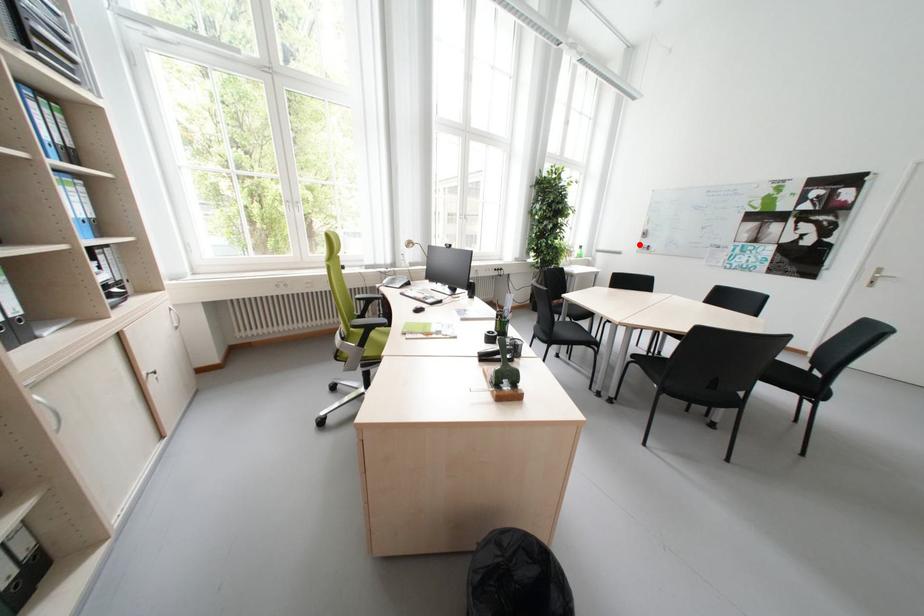
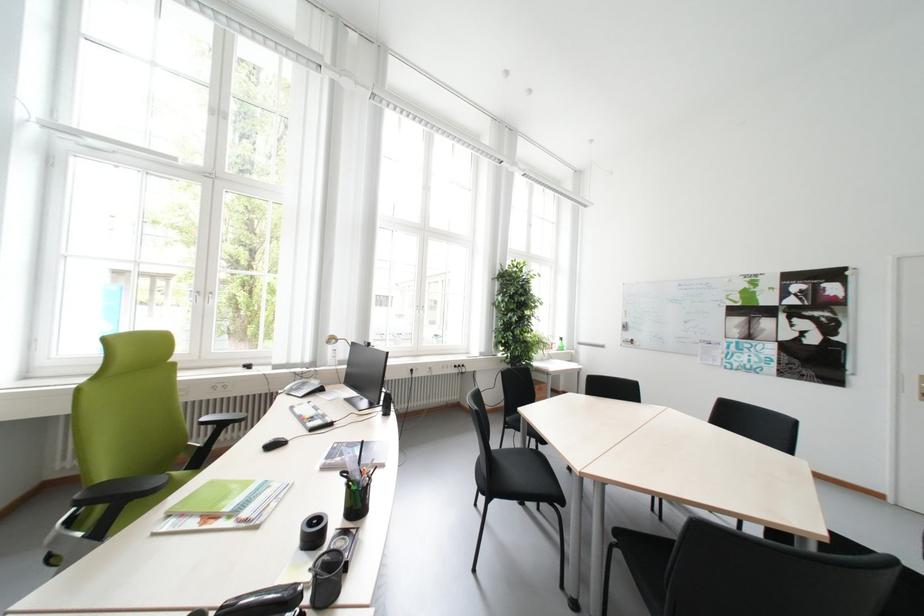
Question: I am providing you with two images of the same scene from different viewpoints. A red point is marked on the first image. At the location where the point appears in image 1, is it still visible in image 2?

Choices:
 (A) Yes
 (B) No

Answer: (A)